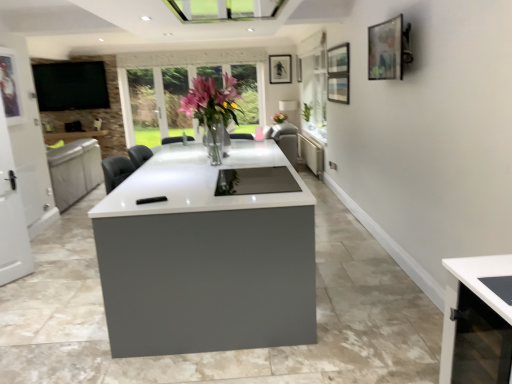
The image size is (512, 384). I want to click on vacant space underneath matte black picture frame at upper right, which is the 4th picture frame in left-to-right order (from a real-world perspective), so click(x=379, y=256).